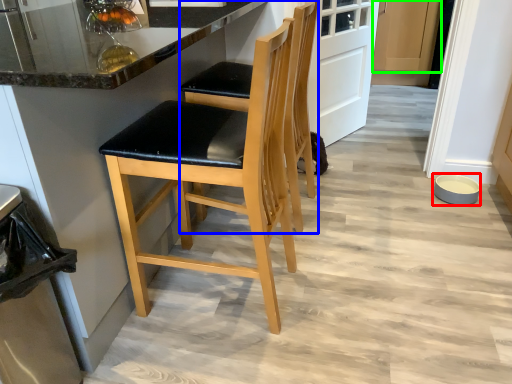
Question: Based on their relative distances, which object is nearer to bowl (highlighted by a red box)? Choose from chair (highlighted by a blue box) and cabinetry (highlighted by a green box).

Choices:
 (A) chair
 (B) cabinetry

Answer: (A)